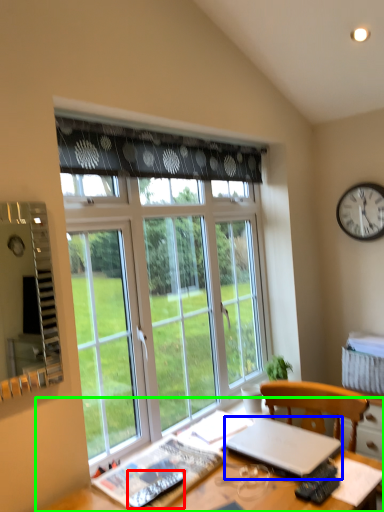
Question: Considering the real-world distances, which object is farthest from remote (highlighted by a red box)? laptop (highlighted by a blue box) or desk (highlighted by a green box)?

Choices:
 (A) laptop
 (B) desk

Answer: (A)